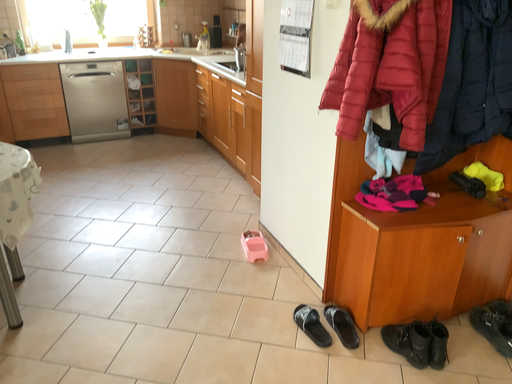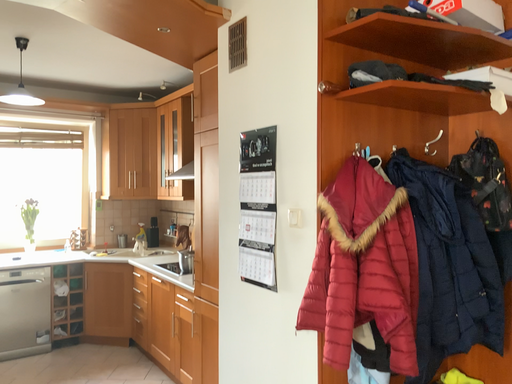
Question: Which way did the camera rotate in the video?

Choices:
 (A) rotated right
 (B) rotated left

Answer: (A)